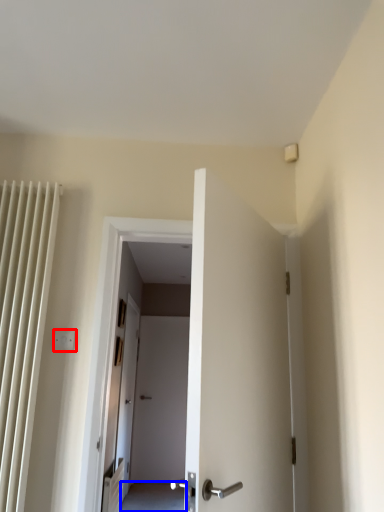
Question: Which object is further to the camera taking this photo, electric outlet (highlighted by a red box) or path (highlighted by a blue box)?

Choices:
 (A) electric outlet
 (B) path

Answer: (B)